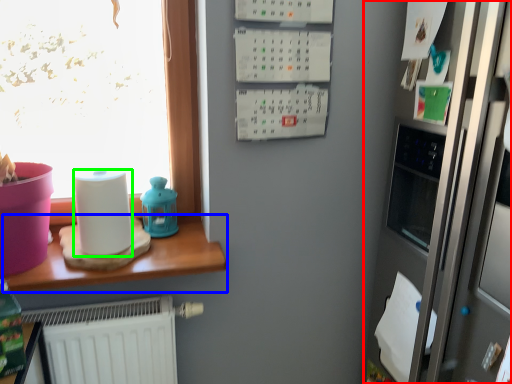
Question: Based on their relative distances, which object is farther from fridge (highlighted by a red box)? Choose from table (highlighted by a blue box) and paper towel (highlighted by a green box).

Choices:
 (A) table
 (B) paper towel

Answer: (B)